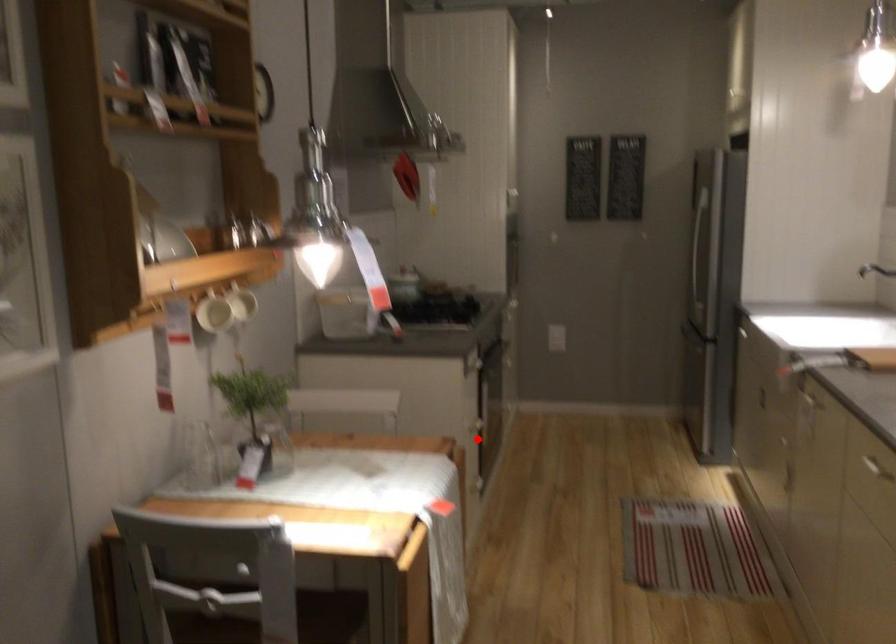
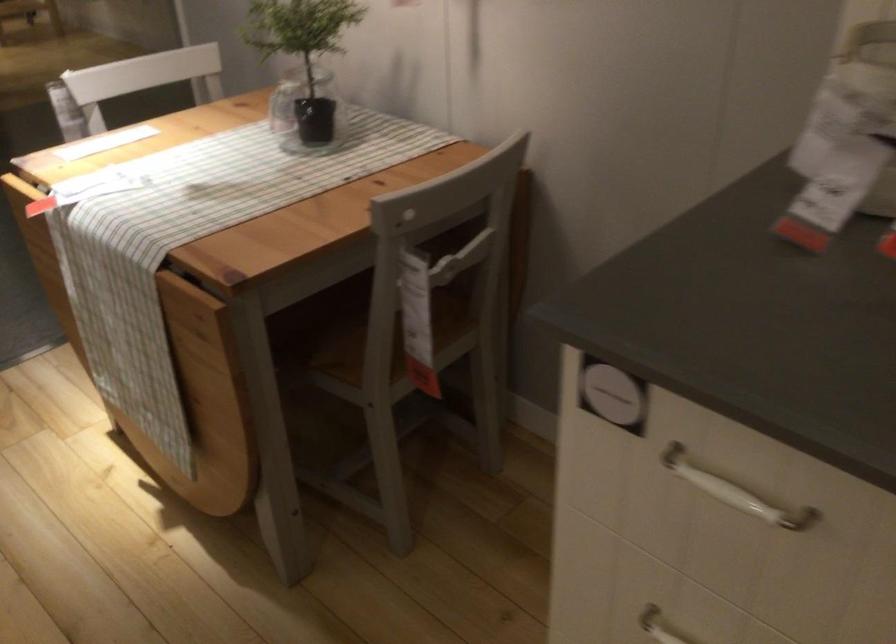
Find the pixel in the second image that matches the highlighted location in the first image.

(659, 626)